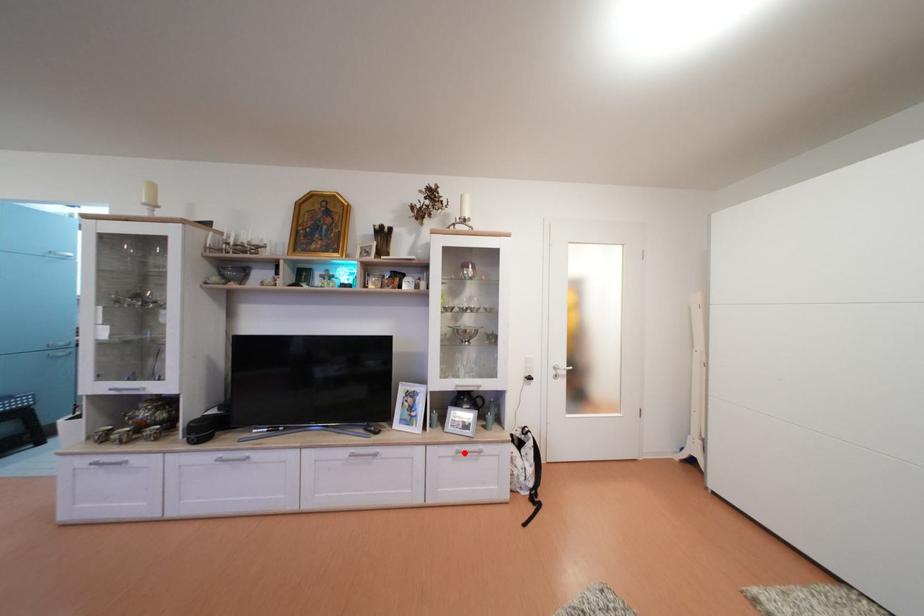
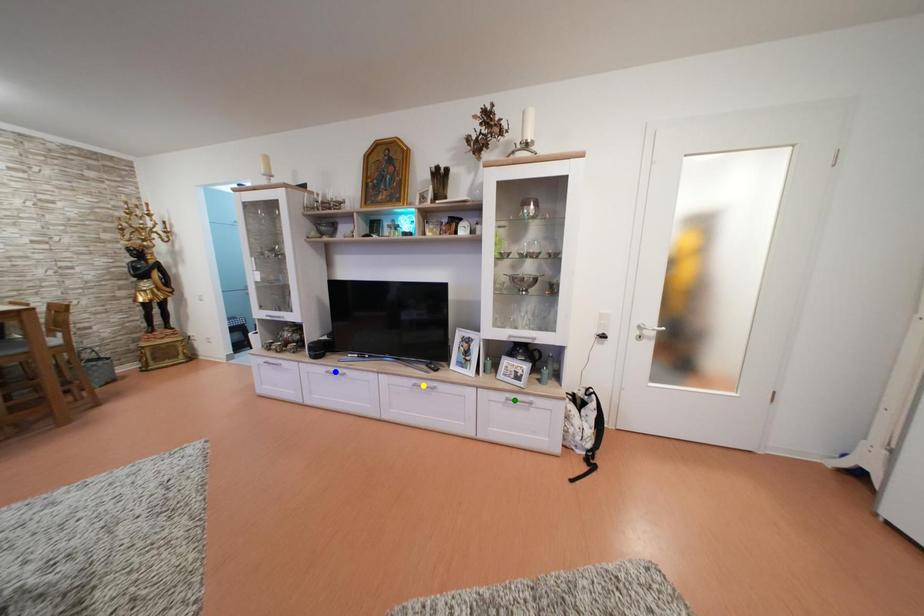
Question: I am providing you with two images of the same scene from different viewpoints. A red point is marked on the first image. You are given multiple points on the second image. Can you choose the point in image 2 that corresponds to the point in image 1?

Choices:
 (A) yellow point
 (B) green point
 (C) blue point

Answer: (B)